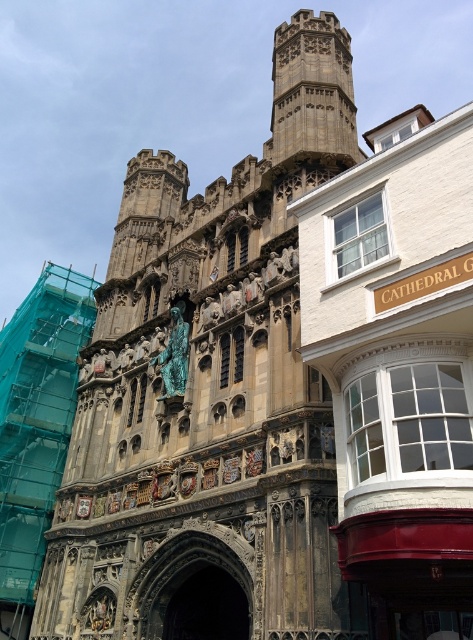
Does stone tower at center have a lesser width compared to gold metallic clock at center?

No, stone tower at center is not thinner than gold metallic clock at center.

Who is more forward, (152, 173) or (82, 506)?

Positioned in front is point (82, 506).

Where is `stone tower at center`? This screenshot has height=640, width=473. stone tower at center is located at coordinates coord(209,394).